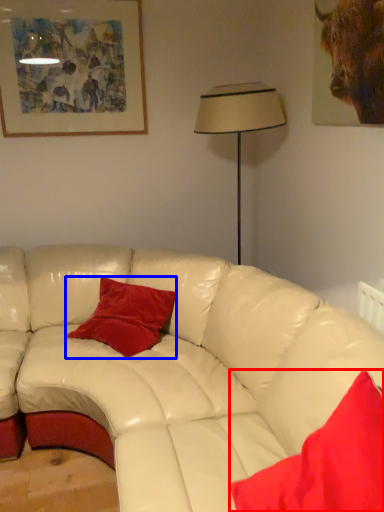
Question: Which object appears closest to the camera in this image, pillow (highlighted by a red box) or pillow (highlighted by a blue box)?

Choices:
 (A) pillow
 (B) pillow

Answer: (A)